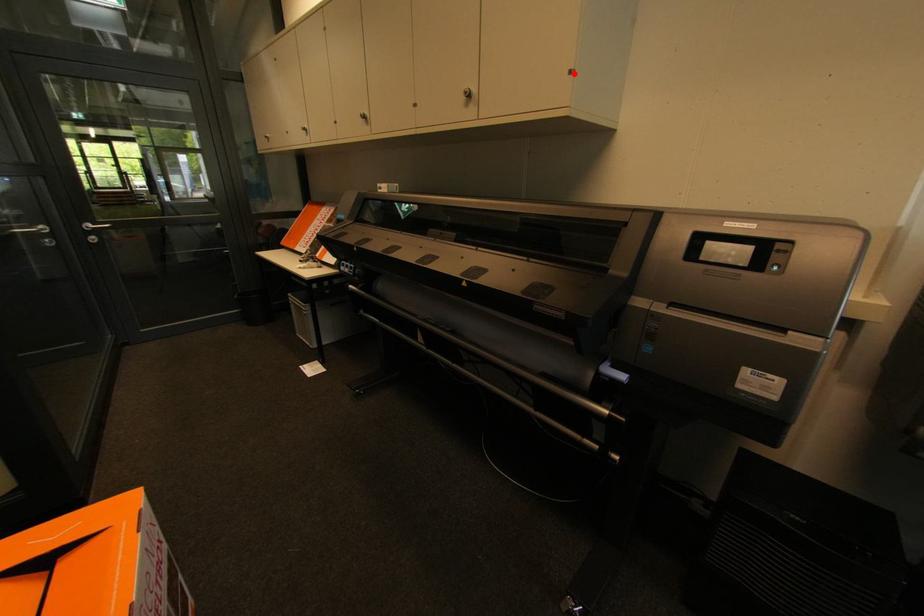
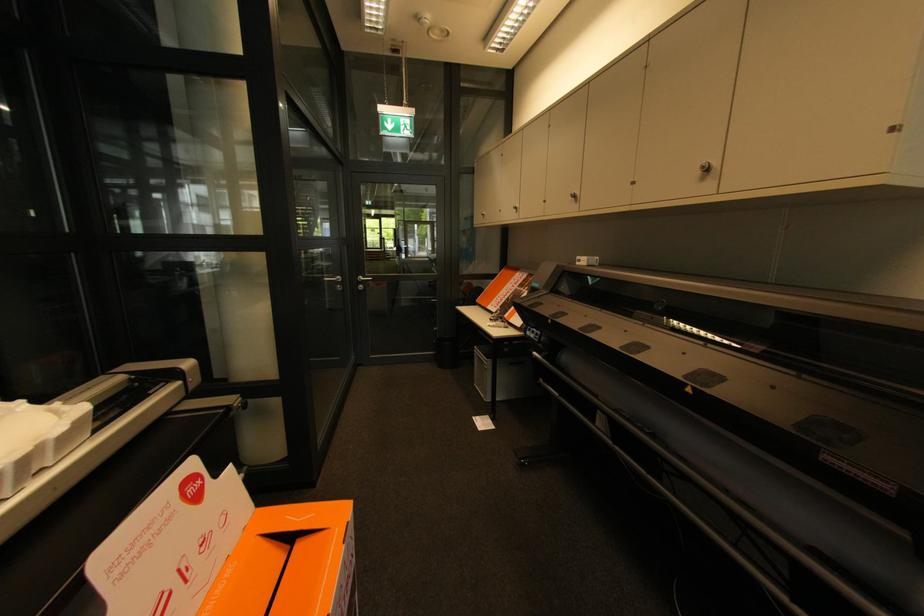
Question: I am providing you with two images of the same scene from different viewpoints. Given a red point in image1, look at the same physical point in image2. Is it:

Choices:
 (A) Closer to the viewpoint
 (B) Farther from the viewpoint

Answer: (B)